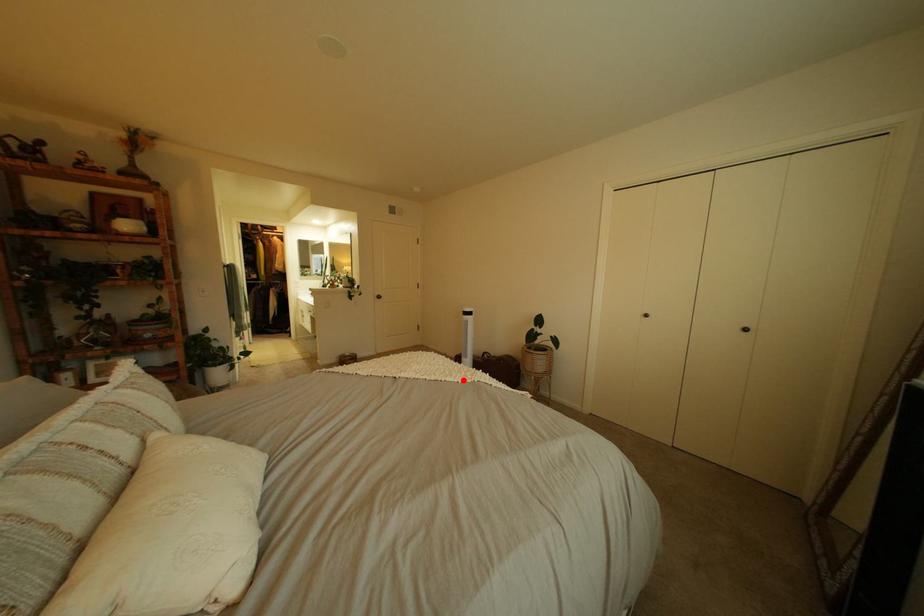
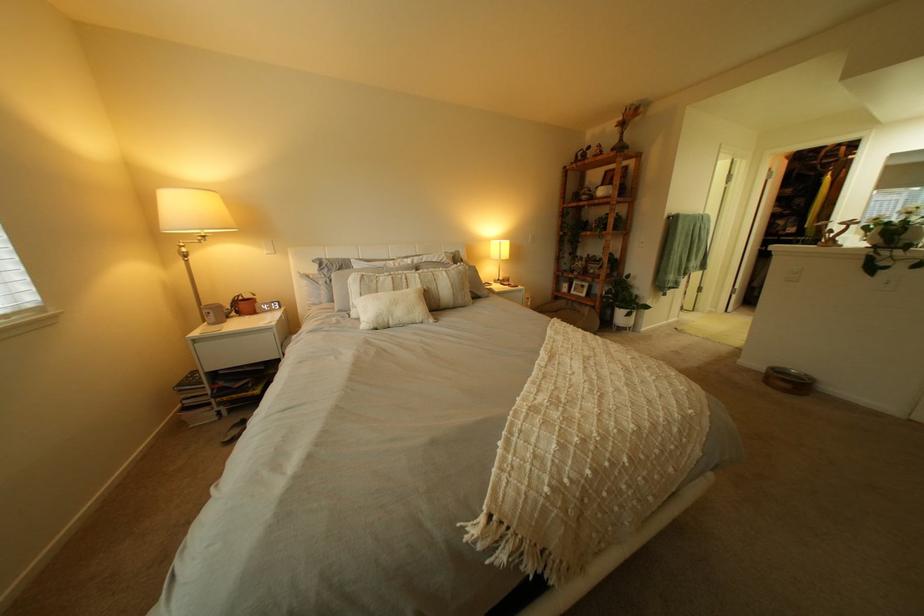
Find the pixel in the second image that matches the highlighted location in the first image.

(541, 387)